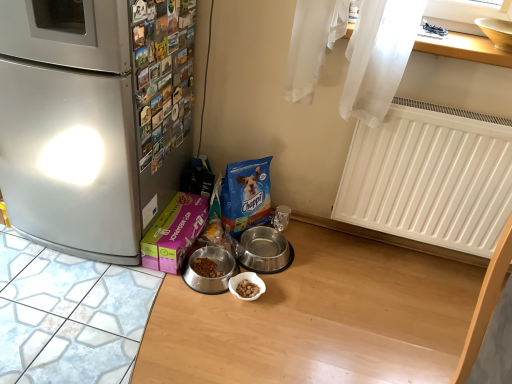
Question: Does pink matte box at lower left turn towards metallic stainless steel bowl at center, which is the 1th appliance in left-to-right order?

Choices:
 (A) no
 (B) yes

Answer: (B)

Question: Can you confirm if pink matte box at lower left is smaller than metallic stainless steel bowl at center, which is the 1th appliance in left-to-right order?

Choices:
 (A) yes
 (B) no

Answer: (B)

Question: Does pink matte box at lower left have a lesser width compared to metallic stainless steel bowl at center, which appears as the first appliance when ordered from the bottom?

Choices:
 (A) no
 (B) yes

Answer: (B)

Question: From a real-world perspective, is pink matte box at lower left on metallic stainless steel bowl at center, arranged as the third appliance when viewed from the right?

Choices:
 (A) yes
 (B) no

Answer: (A)

Question: Can you confirm if pink matte box at lower left is positioned to the left of metallic stainless steel bowl at center, which appears as the first appliance when ordered from the bottom?

Choices:
 (A) no
 (B) yes

Answer: (B)

Question: Is point (429, 129) closer or farther from the camera than point (172, 233)?

Choices:
 (A) closer
 (B) farther

Answer: (A)

Question: From a real-world perspective, is white plastic radiator at right above or below pink matte box at lower left?

Choices:
 (A) above
 (B) below

Answer: (A)

Question: Would you say white plastic radiator at right is to the left or to the right of pink matte box at lower left in the picture?

Choices:
 (A) right
 (B) left

Answer: (A)

Question: Which is correct: white plastic radiator at right is inside pink matte box at lower left, or outside of it?

Choices:
 (A) outside
 (B) inside

Answer: (A)

Question: Relative to yellow ceramic bowl at upper right, which is the third appliance from left to right, is metallic stainless steel bowl at center, which is the 1th appliance in left-to-right order, in front or behind?

Choices:
 (A) behind
 (B) front

Answer: (A)

Question: Based on their positions, is metallic stainless steel bowl at center, which appears as the 3th appliance when viewed from the top, located to the left or right of yellow ceramic bowl at upper right, which ranks as the 1th appliance in right-to-left order?

Choices:
 (A) left
 (B) right

Answer: (A)

Question: From the image's perspective, is metallic stainless steel bowl at center, which is the 1th appliance in left-to-right order, positioned above or below yellow ceramic bowl at upper right, which is the third appliance from left to right?

Choices:
 (A) above
 (B) below

Answer: (B)

Question: Considering the positions of metallic stainless steel bowl at center, which appears as the 3th appliance when viewed from the top, and yellow ceramic bowl at upper right, which ranks as the 1th appliance in right-to-left order, in the image, is metallic stainless steel bowl at center, which appears as the 3th appliance when viewed from the top, wider or thinner than yellow ceramic bowl at upper right, which ranks as the 1th appliance in right-to-left order,?

Choices:
 (A) wide
 (B) thin

Answer: (A)

Question: Does point (44, 3) appear closer or farther from the camera than point (497, 39)?

Choices:
 (A) farther
 (B) closer

Answer: (B)

Question: Which is correct: brushed metal refrigerator at left is inside yellow ceramic bowl at upper right, which is the third appliance from left to right, or outside of it?

Choices:
 (A) outside
 (B) inside

Answer: (A)